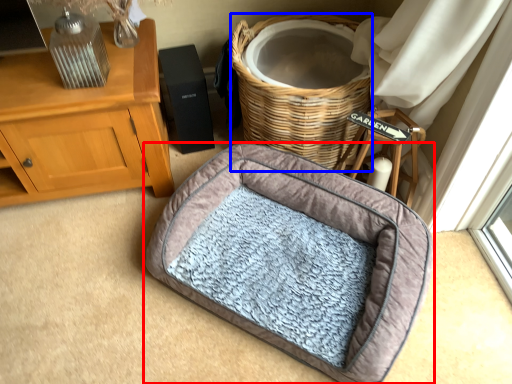
Question: Which point is further to the camera, dog bed (highlighted by a red box) or basket (highlighted by a blue box)?

Choices:
 (A) dog bed
 (B) basket

Answer: (B)